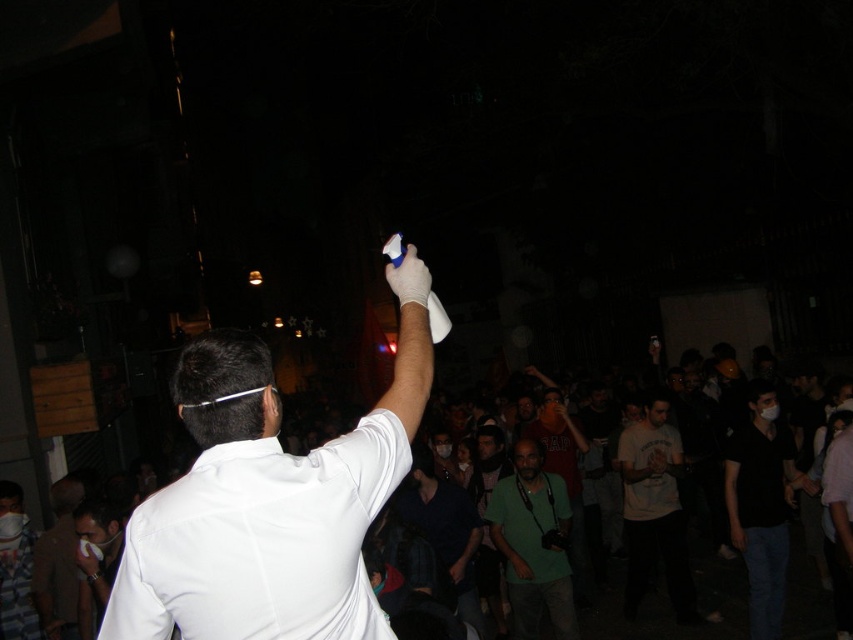
Question: Which of the following is the farthest from the observer?

Choices:
 (A) white matte game controller at upper center
 (B) light brown leather jacket at lower left
 (C) black matte shirt at center-right
 (D) green fabric shirt at center

Answer: (D)

Question: Is the position of black matte shirt at center-right more distant than that of green fabric shirt at center?

Choices:
 (A) yes
 (B) no

Answer: (B)

Question: Does white matte shirt at upper center come behind light gray t-shirt at center?

Choices:
 (A) yes
 (B) no

Answer: (B)

Question: Which object is the closest to the white matte shirt at upper center?

Choices:
 (A) light brown leather jacket at lower left
 (B) light gray t-shirt at center

Answer: (A)

Question: Is black matte shirt at center-right positioned behind green fabric shirt at center?

Choices:
 (A) yes
 (B) no

Answer: (B)

Question: Which of the following is the farthest from the observer?

Choices:
 (A) green fabric shirt at center
 (B) light gray t-shirt at center
 (C) dark blue shirt at center
 (D) white matte shirt at upper center

Answer: (B)